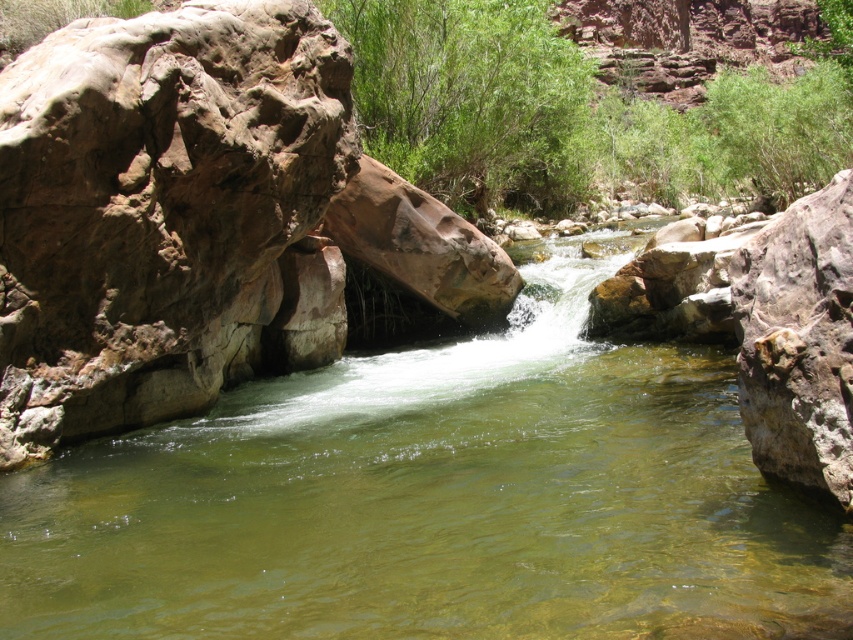
You are a hiker trying to cross the stream. You see the clear water stream at center and the brown rough rock at left. Which one is higher in elevation?

The brown rough rock at left is taller than the clear water stream at center, so the brown rough rock at left is higher in elevation.

You are a hiker planning to cross the clear water stream at center while avoiding the green leafy shrubs at center. Can you walk straight from one to the other without changing direction?

The clear water stream at center and green leafy shrubs at center are 31.78 meters apart, so you can walk straight between them without needing to change direction as the distance is manageable for a straight path.

You are a hiker standing at the edge of the stream and want to take a photo of both the clear water stream at center and the green leafy shrubs at center. Which object should you focus on first to ensure both are in focus?

You should focus on the clear water stream at center first because it is closer to the viewer than the green leafy shrubs at center. By focusing on the closer object, the shrubs will be within the depth of field and still appear sharp in the photo.